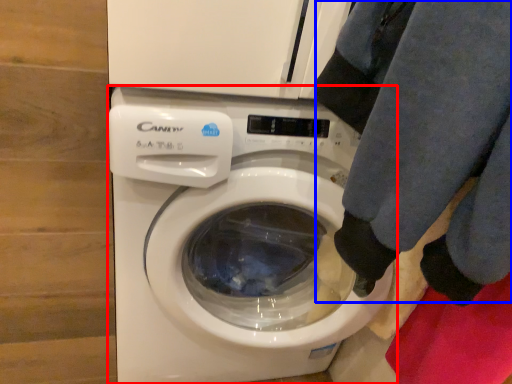
Question: Which of the following is the farthest to the observer, washing machine (highlighted by a red box) or clothing (highlighted by a blue box)?

Choices:
 (A) washing machine
 (B) clothing

Answer: (A)